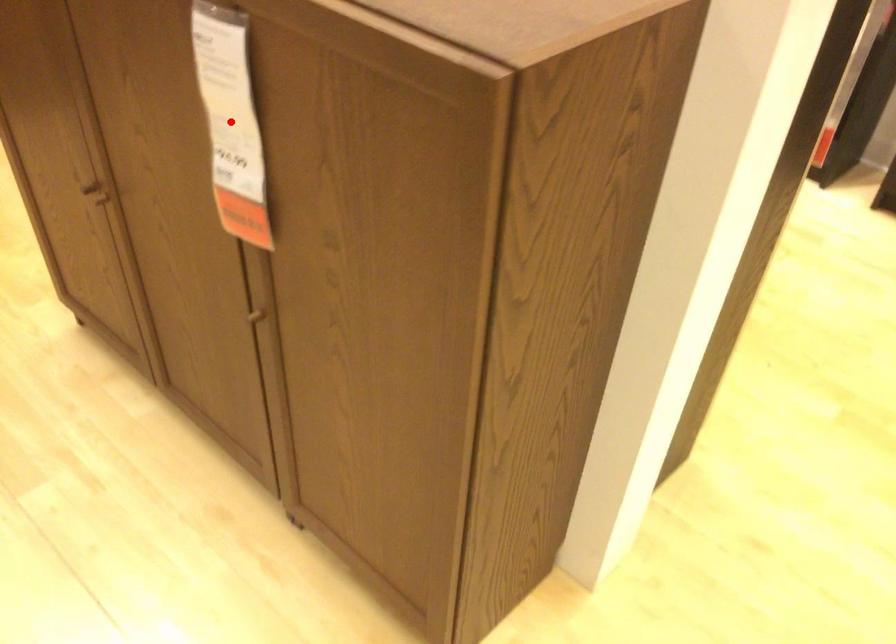
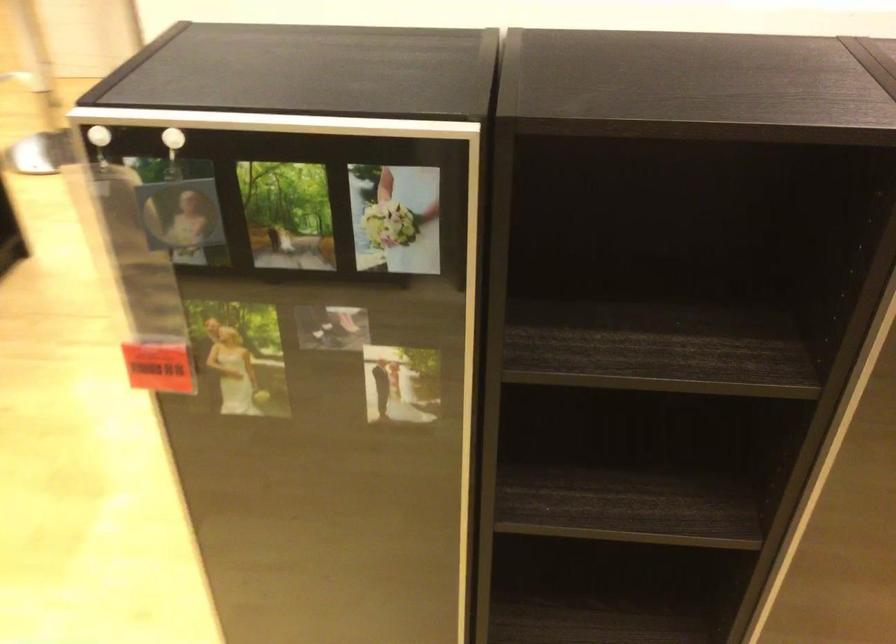
Question: I am providing you with two images of the same scene from different viewpoints. A red point is marked on the first image. Is the red point's position out of view in image 2?

Choices:
 (A) Yes
 (B) No

Answer: (A)